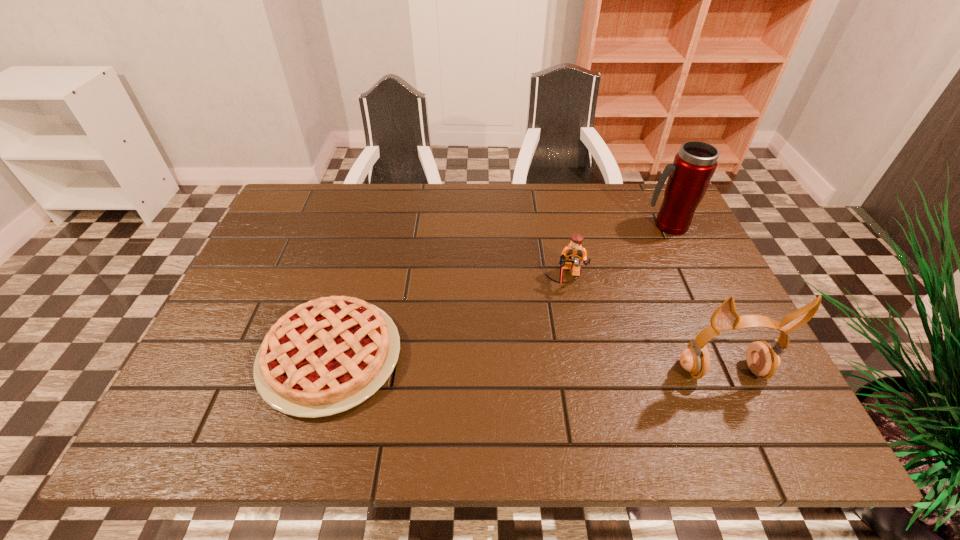
Identify the location of blank region between the thermos bottle and the pie. (498, 291).

You are a GUI agent. You are given a task and a screenshot of the screen. Output one action in this format:
    pyautogui.click(x=<x>, y=<y>)
    Task: Click on the free area in between the Lego and the earphone
    This screenshot has height=540, width=960.
    Given the screenshot: What is the action you would take?
    pyautogui.click(x=644, y=324)

Find the location of a particular element. This screenshot has height=540, width=960. vacant region between the earphone and the third object from right to left is located at coordinates (644, 324).

Where is `vacant space that's between the earphone and the thermos bottle`? The height and width of the screenshot is (540, 960). vacant space that's between the earphone and the thermos bottle is located at coordinates (694, 298).

This screenshot has width=960, height=540. Find the location of `free space that is in between the thermos bottle and the Lego`. free space that is in between the thermos bottle and the Lego is located at coordinates (616, 252).

Locate an element on the screen. Image resolution: width=960 pixels, height=540 pixels. free space between the earphone and the farthest object is located at coordinates (694, 298).

At what (x,y) coordinates should I click in order to perform the action: click on free area in between the earphone and the thermos bottle. Please return your answer as a coordinate pair (x, y). Image resolution: width=960 pixels, height=540 pixels. Looking at the image, I should click on (694, 298).

Image resolution: width=960 pixels, height=540 pixels. In order to click on free point between the thermos bottle and the earphone in this screenshot , I will do `click(694, 298)`.

You are a GUI agent. You are given a task and a screenshot of the screen. Output one action in this format:
    pyautogui.click(x=<x>, y=<y>)
    Task: Click on the object identified as the third closest to the earphone
    The width and height of the screenshot is (960, 540).
    Given the screenshot: What is the action you would take?
    pyautogui.click(x=328, y=355)

Identify which object is the third closest to the shortest object. Please provide its 2D coordinates. Your answer should be formatted as a tuple, i.e. [(x, y)], where the tuple contains the x and y coordinates of a point satisfying the conditions above.

[(689, 176)]